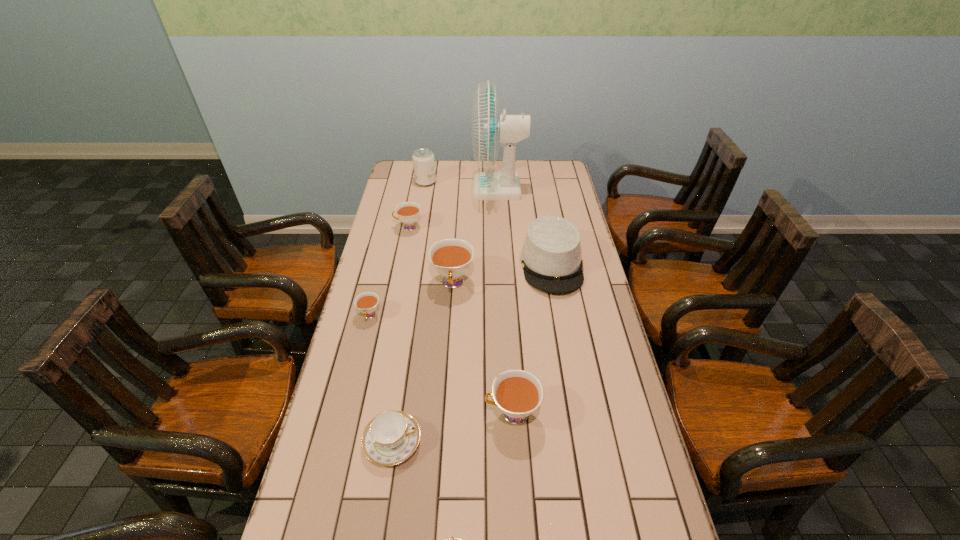
The image size is (960, 540). I want to click on empty space between the second biggest white teacup and the soda can, so click(468, 298).

Locate an element on the screen. The width and height of the screenshot is (960, 540). the closest object relative to the bigger blue teacup is located at coordinates (452, 539).

The image size is (960, 540). I want to click on object that is the sixth closest one to the bigger blue teacup, so click(408, 213).

Locate which teacup ranks third in proximity to the hat. Please provide its 2D coordinates. Your answer should be formatted as a tuple, i.e. [(x, y)], where the tuple contains the x and y coordinates of a point satisfying the conditions above.

[(408, 213)]

Identify which teacup is the fourth closest to the farthest white teacup. Please provide its 2D coordinates. Your answer should be formatted as a tuple, i.e. [(x, y)], where the tuple contains the x and y coordinates of a point satisfying the conditions above.

[(391, 437)]

Select which white teacup is the closest to the right blue teacup. Please provide its 2D coordinates. Your answer should be formatted as a tuple, i.e. [(x, y)], where the tuple contains the x and y coordinates of a point satisfying the conditions above.

[(518, 393)]

Select which white teacup appears as the third closest to the left blue teacup. Please provide its 2D coordinates. Your answer should be formatted as a tuple, i.e. [(x, y)], where the tuple contains the x and y coordinates of a point satisfying the conditions above.

[(451, 258)]

Image resolution: width=960 pixels, height=540 pixels. I want to click on blue teacup that is the nearest to the biggest white teacup, so click(x=391, y=437).

Find the location of a particular element. vacant region that satisfies the following two spatial constraints: 1. in front of the white fan to face the airflow; 2. on the side of the smallest white teacup with the handle is located at coordinates (506, 316).

This screenshot has width=960, height=540. Find the location of `free space that satisfies the following two spatial constraints: 1. on the side of the third nearest white teacup with the handle; 2. on the side with the handle of the left blue teacup`. free space that satisfies the following two spatial constraints: 1. on the side of the third nearest white teacup with the handle; 2. on the side with the handle of the left blue teacup is located at coordinates (443, 442).